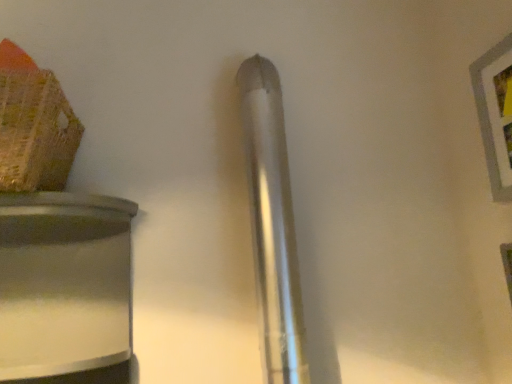
You are a GUI agent. You are given a task and a screenshot of the screen. Output one action in this format:
    pyautogui.click(x=<x>, y=<y>)
    Task: Click on the silver metallic pen at center
    Image resolution: width=512 pixels, height=384 pixels.
    Given the screenshot: What is the action you would take?
    pyautogui.click(x=272, y=224)

The height and width of the screenshot is (384, 512). What do you see at coordinates (272, 224) in the screenshot? I see `silver metallic pen at center` at bounding box center [272, 224].

In order to face silver metallic pen at center, should I rotate leftwards or rightwards?

Rotate your view right by about 2.021°.

Where is `silver metallic pen at center`? This screenshot has width=512, height=384. silver metallic pen at center is located at coordinates tap(272, 224).